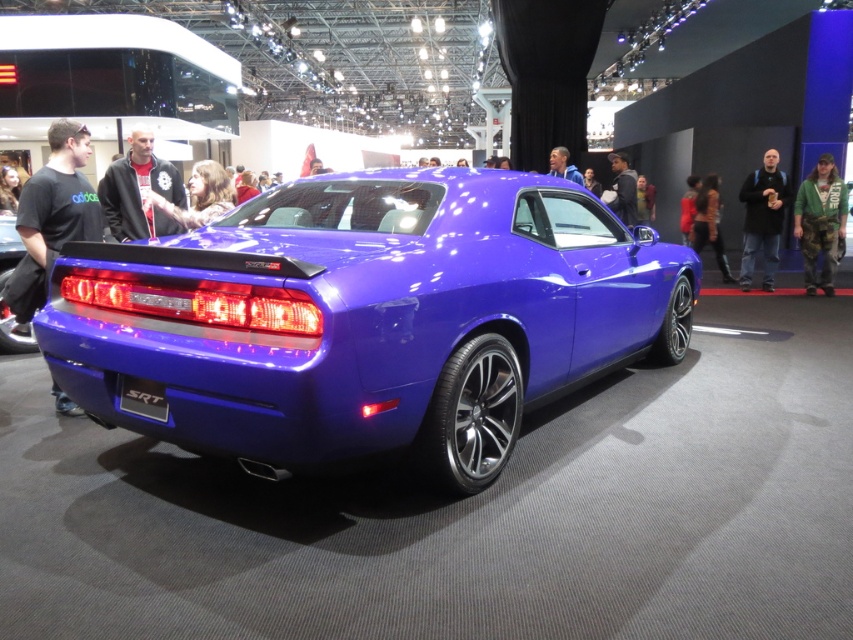
Who is positioned more to the right, green camouflage pants at right or dark gray hoodie at center?

green camouflage pants at right

Is green camouflage pants at right smaller than dark gray hoodie at center?

Incorrect, green camouflage pants at right is not smaller in size than dark gray hoodie at center.

Who is more forward, (802,218) or (616,163)?

Point (802,218) is in front.

The height and width of the screenshot is (640, 853). I want to click on green camouflage pants at right, so click(x=820, y=221).

In order to click on glossy blue car at center in this screenshot , I will do `click(4, 288)`.

Does point (10, 230) lie behind point (4, 195)?

No.

Does point (9, 216) come in front of point (6, 184)?

Yes.

The height and width of the screenshot is (640, 853). I want to click on glossy blue car at center, so click(x=4, y=288).

Can you confirm if glossy metallic car at center is positioned above fluffy brown hair at center?

Incorrect, glossy metallic car at center is not positioned above fluffy brown hair at center.

Which is behind, point (386, 291) or point (229, 189)?

Point (229, 189)

At what (x,y) coordinates should I click in order to perform the action: click on glossy metallic car at center. Please return your answer as a coordinate pair (x, y). Looking at the image, I should click on (368, 317).